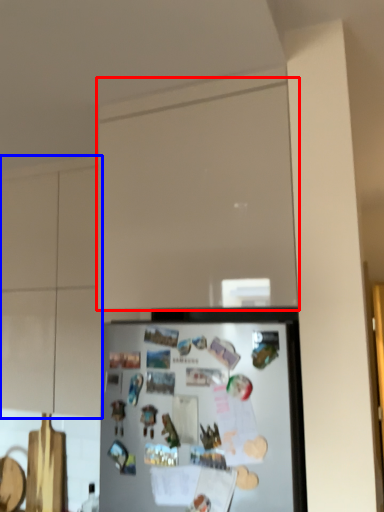
Question: Among these objects, which one is nearest to the camera, glass door (highlighted by a red box) or cabinetry (highlighted by a blue box)?

Choices:
 (A) glass door
 (B) cabinetry

Answer: (A)